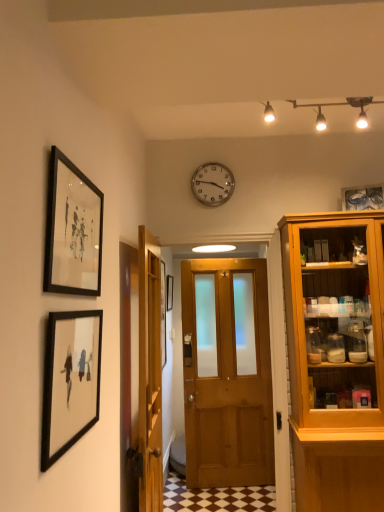
Question: Is wooden door at center, the 2th door positioned from the left, spatially inside white glossy track lights at upper center, or outside of it?

Choices:
 (A) outside
 (B) inside

Answer: (A)

Question: From the image's perspective, is wooden door at center, the 1th door positioned from the right, above or below white glossy track lights at upper center?

Choices:
 (A) below
 (B) above

Answer: (A)

Question: Which is nearer to the wooden door at center, the 1th door positioned from the right?

Choices:
 (A) black matte picture frame at center, which is the 1th picture frame in back-to-front order
 (B) clear glass picture frame at upper right, placed as the 1th picture frame when sorted from right to left
 (C) white glossy track lights at upper center
 (D) wooden door at center, which is the first door in left-to-right order
 (E) black matte picture frame at upper left, marked as the 2th picture frame in a left-to-right arrangement

Answer: (A)

Question: Which object is the farthest from the wooden door at center, the 1th door positioned from the right?

Choices:
 (A) wooden door at center, which is the first door in left-to-right order
 (B) black matte picture frame at lower left, the 4th picture frame from the right
 (C) clear glass picture frame at upper right, which is the second picture frame from back to front
 (D) black matte picture frame at center, marked as the 2th picture frame in a right-to-left arrangement
 (E) black matte picture frame at upper left, which ranks as the 3th picture frame in back-to-front order

Answer: (E)